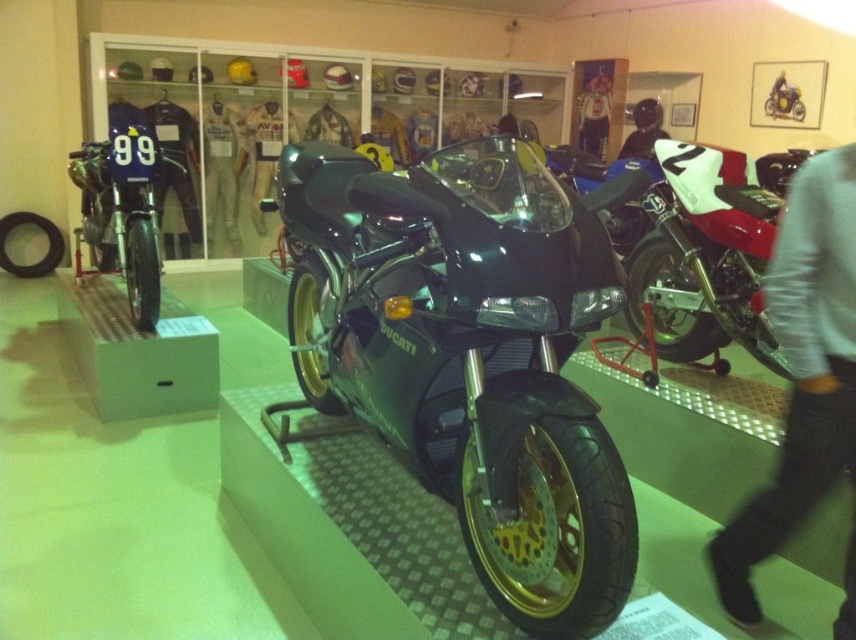
Question: Does gray sweater at upper right lie behind white/red/glossy motorcycle at right?

Choices:
 (A) no
 (B) yes

Answer: (A)

Question: Does gray sweater at upper right have a larger size compared to white/red/glossy motorcycle at right?

Choices:
 (A) yes
 (B) no

Answer: (B)

Question: Where is shiny black motorcycle at center located in relation to white/red/glossy motorcycle at right in the image?

Choices:
 (A) left
 (B) right

Answer: (A)

Question: Which point is closer to the camera?

Choices:
 (A) gray sweater at upper right
 (B) shiny black motorcycle at center

Answer: (B)

Question: Which point is closer to the camera taking this photo?

Choices:
 (A) (76, 234)
 (B) (803, 113)

Answer: (A)

Question: Which object appears closest to the camera in this image?

Choices:
 (A) black leather helmet at upper center
 (B) shiny metallic racing bike at left
 (C) shiny metallic motorcycle at upper right

Answer: (B)